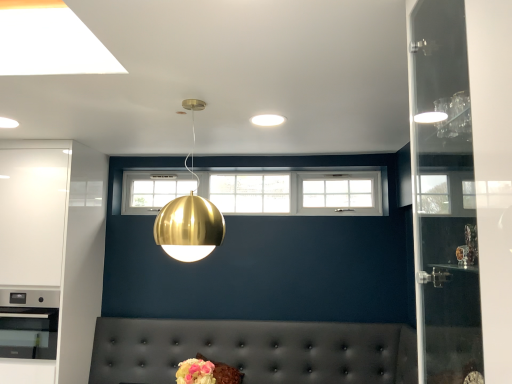
Question: Is white glossy cabinet at left not within gold metallic sphere at center?

Choices:
 (A) yes
 (B) no

Answer: (A)

Question: Is the depth of white glossy cabinet at left greater than that of gold metallic sphere at center?

Choices:
 (A) yes
 (B) no

Answer: (A)

Question: Is white glossy cabinet at left closer to the viewer compared to gold metallic sphere at center?

Choices:
 (A) no
 (B) yes

Answer: (A)

Question: Is white glossy cabinet at left taller than gold metallic sphere at center?

Choices:
 (A) no
 (B) yes

Answer: (B)

Question: From the image's perspective, is white glossy cabinet at left on gold metallic sphere at center?

Choices:
 (A) yes
 (B) no

Answer: (B)

Question: From a real-world perspective, does white glossy cabinet at left stand above gold metallic sphere at center?

Choices:
 (A) yes
 (B) no

Answer: (B)

Question: Is gold metallic sphere at center positioned with its back to white matte light fixture at center?

Choices:
 (A) yes
 (B) no

Answer: (B)

Question: Is gold metallic sphere at center bigger than white matte light fixture at center?

Choices:
 (A) no
 (B) yes

Answer: (B)

Question: Does gold metallic sphere at center touch white matte light fixture at center?

Choices:
 (A) no
 (B) yes

Answer: (A)

Question: Considering the relative sizes of gold metallic sphere at center and white matte light fixture at center in the image provided, is gold metallic sphere at center thinner than white matte light fixture at center?

Choices:
 (A) yes
 (B) no

Answer: (B)

Question: Does gold metallic sphere at center have a greater height compared to white matte light fixture at center?

Choices:
 (A) no
 (B) yes

Answer: (B)

Question: Is gold metallic sphere at center at the right side of white matte light fixture at center?

Choices:
 (A) no
 (B) yes

Answer: (A)

Question: Considering the relative sizes of tufted leather couch at lower center and gold metallic sphere at center in the image provided, is tufted leather couch at lower center thinner than gold metallic sphere at center?

Choices:
 (A) yes
 (B) no

Answer: (B)